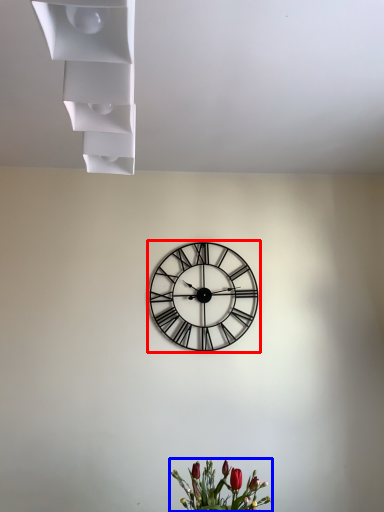
Question: Which point is closer to the camera, wall clock (highlighted by a red box) or floral arrangement (highlighted by a blue box)?

Choices:
 (A) wall clock
 (B) floral arrangement

Answer: (B)